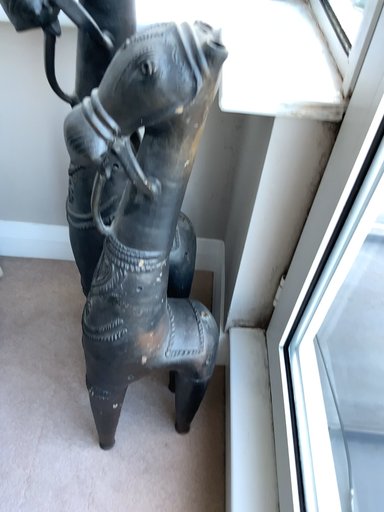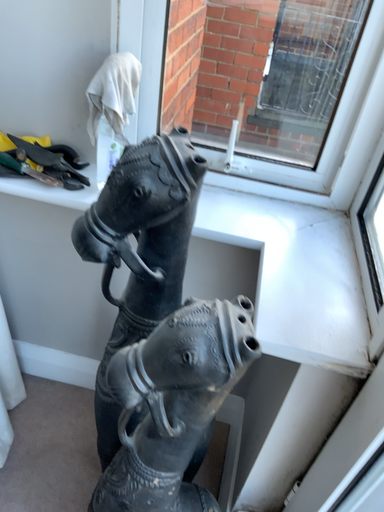
Question: How did the camera likely rotate when shooting the video?

Choices:
 (A) rotated upward
 (B) rotated downward

Answer: (A)